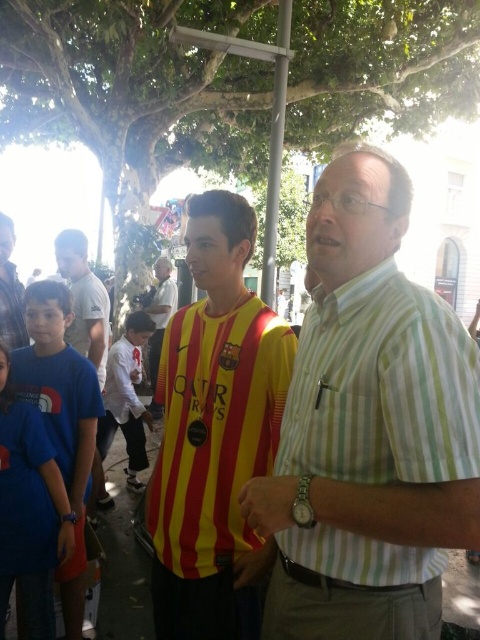
Question: Does green striped shirt at center appear over yellow striped jersey at center?

Choices:
 (A) yes
 (B) no

Answer: (B)

Question: Does yellow striped jersey at center appear on the right side of white fabric shirt at center?

Choices:
 (A) no
 (B) yes

Answer: (A)

Question: Which object is positioned farthest from the green striped shirt at center?

Choices:
 (A) white cotton shirt at center
 (B) blue cotton t-shirt at lower left
 (C) yellow striped jersey at center

Answer: (A)

Question: Estimate the real-world distances between objects in this image. Which object is farther from the yellow striped jersey at center?

Choices:
 (A) yellow/red striped jersey at center
 (B) blue cotton t-shirt at lower left
 (C) white fabric shirt at center
 (D) white cotton shirt at center

Answer: (C)

Question: Where is yellow striped jersey at center located in relation to white fabric shirt at center in the image?

Choices:
 (A) right
 (B) left

Answer: (B)

Question: Which point is farther from the camera taking this photo?

Choices:
 (A) (432, 552)
 (B) (247, 234)

Answer: (B)